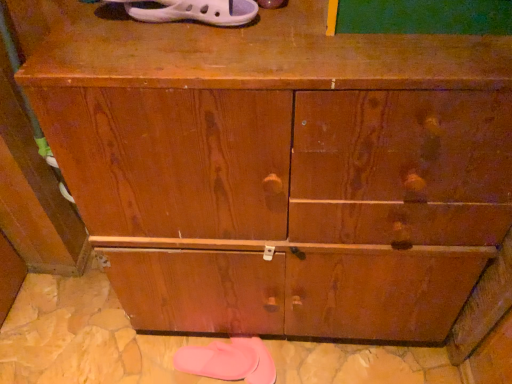
Question: Is point (239, 11) positioned closer to the camera than point (195, 370)?

Choices:
 (A) farther
 (B) closer

Answer: (B)

Question: In the image, is white rubber sandal at upper center, arranged as the 1th footwear when viewed from the top, on the left side or the right side of pink rubber slipper at lower center, acting as the 2th footwear starting from the front?

Choices:
 (A) right
 (B) left

Answer: (A)

Question: Is white rubber sandal at upper center, placed as the second footwear when sorted from back to front, inside the boundaries of pink rubber slipper at lower center, positioned as the 1th footwear in back-to-front order, or outside?

Choices:
 (A) outside
 (B) inside

Answer: (A)

Question: From the image's perspective, relative to white rubber sandal at upper center, positioned as the first footwear in front-to-back order, is pink rubber slipper at lower center, the first footwear from the bottom, above or below?

Choices:
 (A) above
 (B) below

Answer: (B)

Question: Based on their positions, is pink rubber slipper at lower center, which is counted as the second footwear, starting from the top, located to the left or right of white rubber sandal at upper center, arranged as the 1th footwear when viewed from the top?

Choices:
 (A) left
 (B) right

Answer: (A)

Question: Is point (234, 370) positioned closer to the camera than point (134, 16)?

Choices:
 (A) closer
 (B) farther

Answer: (B)

Question: From a real-world perspective, is pink rubber slipper at lower center, positioned as the 1th footwear in back-to-front order, above or below white rubber sandal at upper center, placed as the second footwear when sorted from back to front?

Choices:
 (A) above
 (B) below

Answer: (B)